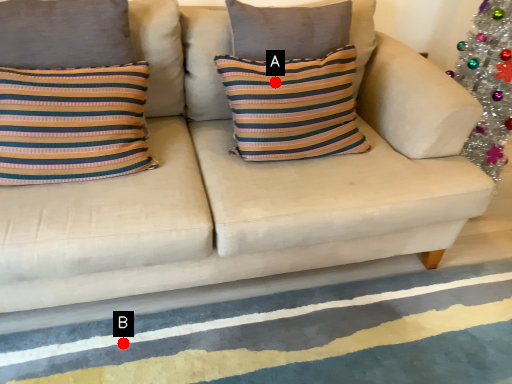
Question: Two points are circled on the image, labeled by A and B beside each circle. Among these points, which one is nearest to the camera?

Choices:
 (A) A is closer
 (B) B is closer

Answer: (B)